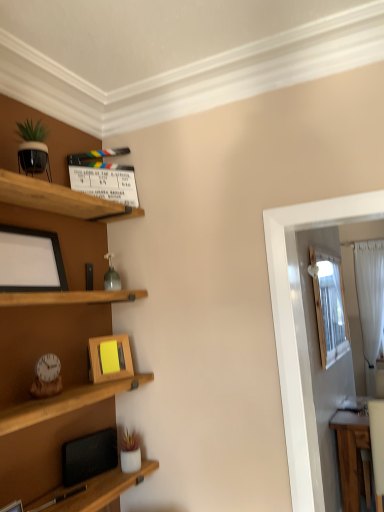
From the picture: Measure the distance between point [96,350] and camera.

Point [96,350] is 5.88 feet away from camera.

What do you see at coordinates (99, 359) in the screenshot? I see `wooden picture frame at center, which ranks as the 2th picture frame in top-to-bottom order` at bounding box center [99, 359].

At what (x,y) coordinates should I click in order to perform the action: click on matte black picture frame at left, which ranks as the first picture frame in front-to-back order. Please return your answer as a coordinate pair (x, y). The image size is (384, 512). Looking at the image, I should click on (30, 261).

Is white sheer curtain at right oriented towards wooden picture frame at center, which ranks as the 2th picture frame in top-to-bottom order?

No, white sheer curtain at right is not oriented towards wooden picture frame at center, which ranks as the 2th picture frame in top-to-bottom order.

Looking at this image, is the depth of white sheer curtain at right greater than that of wooden picture frame at center, positioned as the 1th picture frame in right-to-left order?

Yes, white sheer curtain at right is further from the viewer.

How much distance is there between white sheer curtain at right and wooden picture frame at center, which is the 2th picture frame in front-to-back order?

white sheer curtain at right is 2.64 meters from wooden picture frame at center, which is the 2th picture frame in front-to-back order.

Considering the relative sizes of white sheer curtain at right and wooden picture frame at center, which is counted as the 1th picture frame, starting from the bottom, in the image provided, is white sheer curtain at right bigger than wooden picture frame at center, which is counted as the 1th picture frame, starting from the bottom,?

Indeed, white sheer curtain at right has a larger size compared to wooden picture frame at center, which is counted as the 1th picture frame, starting from the bottom.

Is wooden picture frame at center, which is counted as the 1th picture frame, starting from the bottom, thinner than matte black picture frame at left, which is the first picture frame in left-to-right order?

Indeed, wooden picture frame at center, which is counted as the 1th picture frame, starting from the bottom, has a lesser width compared to matte black picture frame at left, which is the first picture frame in left-to-right order.

I want to click on picture frame directly beneath the matte black picture frame at left, the 2th picture frame in the right-to-left sequence (from a real-world perspective), so click(x=99, y=359).

Is wooden picture frame at center, which is the 2th picture frame in front-to-back order, positioned beyond the bounds of matte black picture frame at left, which is the first picture frame in left-to-right order?

Yes, wooden picture frame at center, which is the 2th picture frame in front-to-back order, is located beyond the bounds of matte black picture frame at left, which is the first picture frame in left-to-right order.

Would you say matte black picture frame at left, the 2th picture frame in the right-to-left sequence, is to the left or to the right of white sheer curtain at right in the picture?

In the image, matte black picture frame at left, the 2th picture frame in the right-to-left sequence, appears on the left side of white sheer curtain at right.

From the image's perspective, which one is positioned higher, matte black picture frame at left, marked as the 2th picture frame in a bottom-to-top arrangement, or white sheer curtain at right?

matte black picture frame at left, marked as the 2th picture frame in a bottom-to-top arrangement.

Which object is closer to the camera, matte black picture frame at left, the 2th picture frame in the right-to-left sequence, or white sheer curtain at right?

matte black picture frame at left, the 2th picture frame in the right-to-left sequence, is in front.

Which of these two, matte black picture frame at left, which ranks as the first picture frame in front-to-back order, or white sheer curtain at right, stands taller?

With more height is white sheer curtain at right.

Is white sheer curtain at right inside the boundaries of matte black picture frame at left, marked as the 2th picture frame in a bottom-to-top arrangement, or outside?

white sheer curtain at right is spatially situated outside matte black picture frame at left, marked as the 2th picture frame in a bottom-to-top arrangement.

Which of these two, white sheer curtain at right or matte black picture frame at left, which ranks as the first picture frame in front-to-back order, stands shorter?

matte black picture frame at left, which ranks as the first picture frame in front-to-back order, is shorter.

What's the angular difference between white sheer curtain at right and matte black picture frame at left, the 2th picture frame positioned from the back,'s facing directions?

The facing directions of white sheer curtain at right and matte black picture frame at left, the 2th picture frame positioned from the back, are 90.5 degrees apart.

Can you confirm if matte black picture frame at left, marked as the 2th picture frame in a bottom-to-top arrangement, is positioned to the right of wooden picture frame at center, positioned as the 1th picture frame in right-to-left order?

No.

From a real-world perspective, who is located higher, matte black picture frame at left, the 2th picture frame in the right-to-left sequence, or wooden picture frame at center, which is counted as the 1th picture frame, starting from the bottom?

matte black picture frame at left, the 2th picture frame in the right-to-left sequence, from a real-world perspective.

Which is more distant, (17, 247) or (102, 375)?

The point (102, 375) is farther from the camera.

In the scene shown: From the image's perspective, is matte black picture frame at left, the 2th picture frame positioned from the back, on top of wooden picture frame at center, which ranks as the 2th picture frame in top-to-bottom order?

Yes, from the image's perspective, matte black picture frame at left, the 2th picture frame positioned from the back, is above wooden picture frame at center, which ranks as the 2th picture frame in top-to-bottom order.

Between wooden picture frame at center, which is the second picture frame in left-to-right order, and white sheer curtain at right, which one has larger width?

white sheer curtain at right is wider.

Based on their sizes in the image, would you say wooden picture frame at center, positioned as the 1th picture frame in right-to-left order, is bigger or smaller than white sheer curtain at right?

wooden picture frame at center, positioned as the 1th picture frame in right-to-left order, is smaller than white sheer curtain at right.

Visually, is wooden picture frame at center, which is the 2th picture frame in front-to-back order, positioned to the left or to the right of white sheer curtain at right?

wooden picture frame at center, which is the 2th picture frame in front-to-back order, is to the left of white sheer curtain at right.

Is point (126, 350) less distant than point (366, 243)?

Yes.

I want to click on the 1st picture frame in front of the white sheer curtain at right, starting your count from the anchor, so click(x=99, y=359).

Image resolution: width=384 pixels, height=512 pixels. Identify the location of picture frame above the wooden picture frame at center, which ranks as the 1th picture frame in back-to-front order (from a real-world perspective). (30, 261).

From the image, which object appears to be nearer to matte black picture frame at left, the 2th picture frame in the right-to-left sequence, wooden picture frame at center, which ranks as the 1th picture frame in back-to-front order, or white sheer curtain at right?

wooden picture frame at center, which ranks as the 1th picture frame in back-to-front order.

Considering their positions, is matte black picture frame at left, the 2th picture frame positioned from the back, positioned closer to white sheer curtain at right than wooden picture frame at center, positioned as the 1th picture frame in right-to-left order?

Based on the image, wooden picture frame at center, positioned as the 1th picture frame in right-to-left order, appears to be nearer to white sheer curtain at right.

From the image, which object appears to be farther from white sheer curtain at right, wooden picture frame at center, which ranks as the 2th picture frame in top-to-bottom order, or matte black picture frame at left, marked as the 2th picture frame in a bottom-to-top arrangement?

Among the two, matte black picture frame at left, marked as the 2th picture frame in a bottom-to-top arrangement, is located further to white sheer curtain at right.

Estimate the real-world distances between objects in this image. Which object is closer to matte black picture frame at left, which appears as the 1th picture frame when viewed from the top, white sheer curtain at right or wooden picture frame at center, positioned as the 1th picture frame in right-to-left order?

The object closer to matte black picture frame at left, which appears as the 1th picture frame when viewed from the top, is wooden picture frame at center, positioned as the 1th picture frame in right-to-left order.

Estimate the real-world distances between objects in this image. Which object is closer to wooden picture frame at center, which is the second picture frame in left-to-right order, matte black picture frame at left, marked as the 2th picture frame in a bottom-to-top arrangement, or white sheer curtain at right?

Based on the image, matte black picture frame at left, marked as the 2th picture frame in a bottom-to-top arrangement, appears to be nearer to wooden picture frame at center, which is the second picture frame in left-to-right order.

When comparing their distances from wooden picture frame at center, which is the second picture frame in left-to-right order, does white sheer curtain at right or matte black picture frame at left, marked as the 2th picture frame in a bottom-to-top arrangement, seem further?

white sheer curtain at right lies further to wooden picture frame at center, which is the second picture frame in left-to-right order, than the other object.

This screenshot has height=512, width=384. Find the location of `picture frame between matte black picture frame at left, the 2th picture frame in the right-to-left sequence, and white sheer curtain at right from front to back`. picture frame between matte black picture frame at left, the 2th picture frame in the right-to-left sequence, and white sheer curtain at right from front to back is located at coordinates (99, 359).